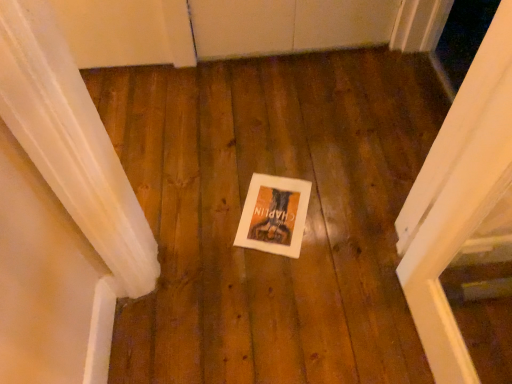
Identify the location of blank space situated above white paper at center (from a real-world perspective). (267, 207).